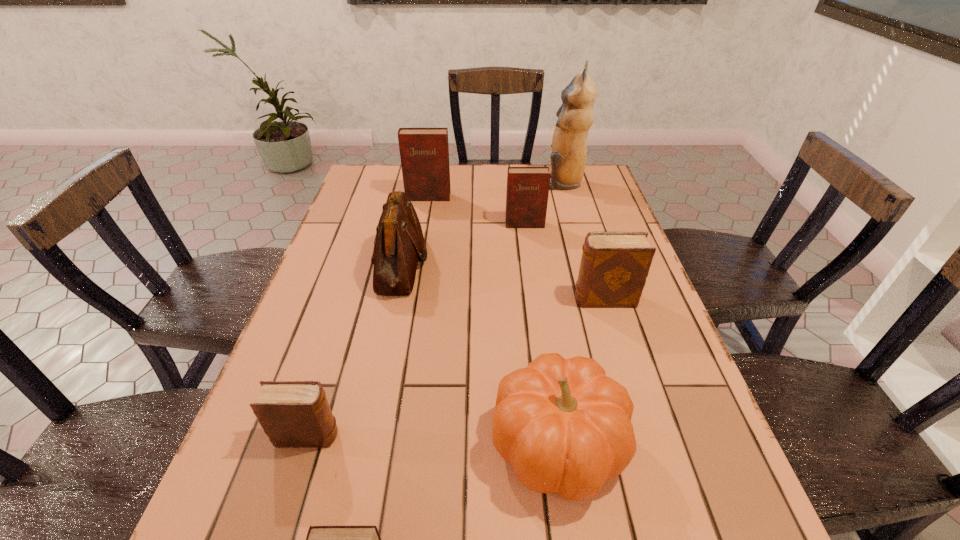
The image size is (960, 540). Find the location of `cat`. cat is located at coordinates (575, 116).

Where is `the farthest object`? The image size is (960, 540). the farthest object is located at coordinates (575, 116).

Image resolution: width=960 pixels, height=540 pixels. What are the coordinates of `the seventh nearest object` in the screenshot? It's located at (424, 152).

Image resolution: width=960 pixels, height=540 pixels. I want to click on the farthest diary, so click(x=424, y=152).

You are a GUI agent. You are given a task and a screenshot of the screen. Output one action in this format:
    pyautogui.click(x=<x>, y=<y>)
    Task: Click on the shoulder bag
    
    Given the screenshot: What is the action you would take?
    [x=399, y=241]

Locate an element on the screen. This screenshot has width=960, height=540. the second farthest reddish-brown diary is located at coordinates [x=527, y=193].

The width and height of the screenshot is (960, 540). In order to click on the second biggest reddish-brown diary in this screenshot , I will do `click(527, 193)`.

You are a GUI agent. You are given a task and a screenshot of the screen. Output one action in this format:
    pyautogui.click(x=<x>, y=<y>)
    Task: Click on the third farthest diary
    This screenshot has width=960, height=540.
    Given the screenshot: What is the action you would take?
    pyautogui.click(x=614, y=266)

Locate an element on the screen. This screenshot has height=540, width=960. the rightmost diary is located at coordinates (614, 266).

Locate an element on the screen. The width and height of the screenshot is (960, 540). orange pumpkin is located at coordinates (565, 426).